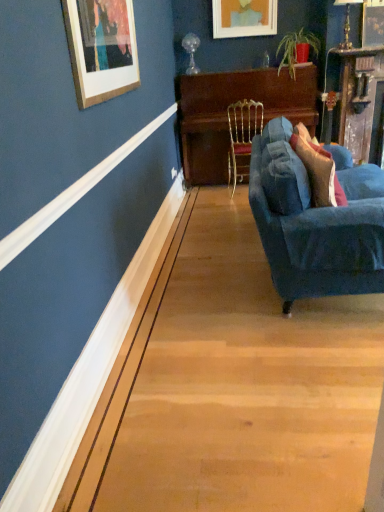
The image size is (384, 512). Identify the location of free space underneath matte wooden picture frame at upper center, placed as the 2th picture frame when sorted from right to left (from a real-world perspective). (239, 67).